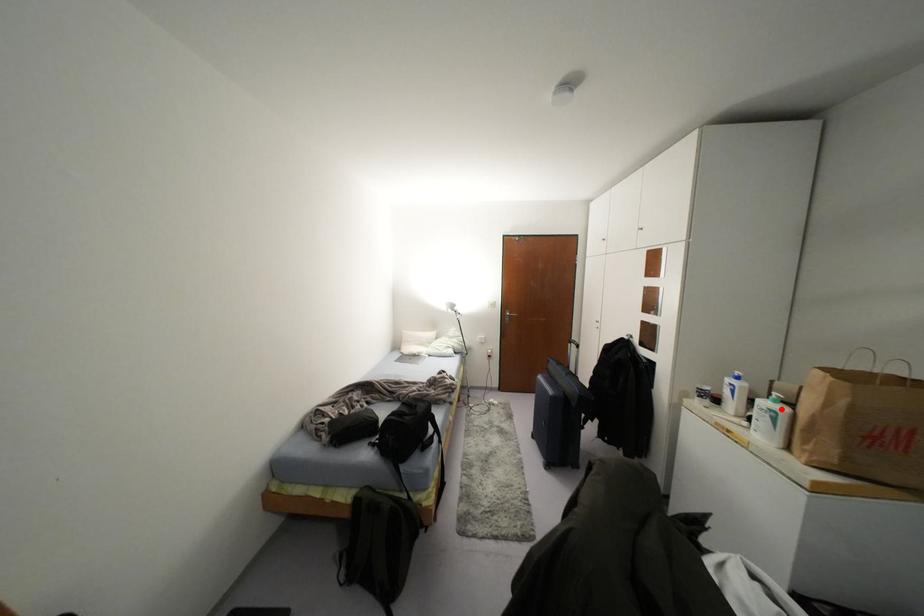
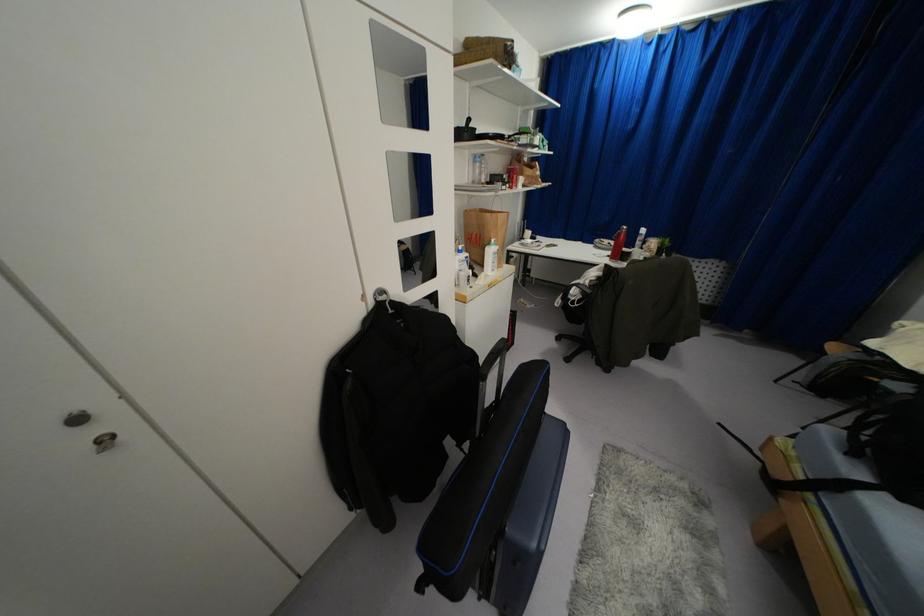
Where in the second image is the point corresponding to the highlighted location from the first image?

(495, 246)